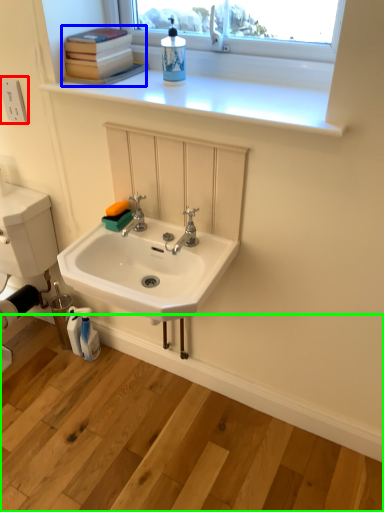
Question: Which is nearer to the electric outlet (highlighted by a red box)? book (highlighted by a blue box) or counter (highlighted by a green box).

Choices:
 (A) book
 (B) counter

Answer: (A)